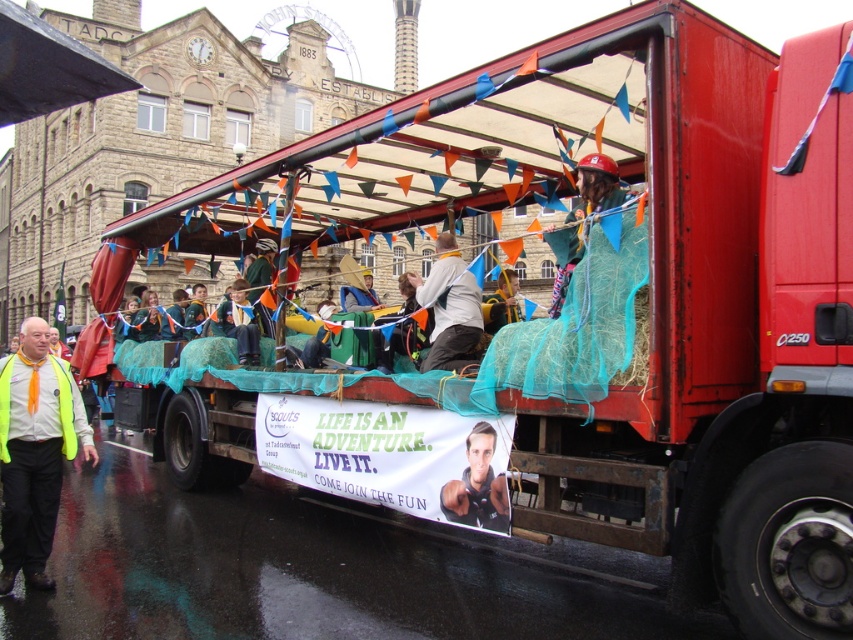
Question: Which object is closer to the camera taking this photo?

Choices:
 (A) white fabric at center
 (B) neon yellow vest at left
 (C) green fabric-covered figure at center

Answer: (B)

Question: Does white fabric at center come in front of matte green netting at center?

Choices:
 (A) yes
 (B) no

Answer: (A)

Question: Can you confirm if white fabric at center is smaller than matte green netting at center?

Choices:
 (A) no
 (B) yes

Answer: (A)

Question: Does smooth skin portrait at center appear under green fabric-covered figure at center?

Choices:
 (A) no
 (B) yes

Answer: (B)

Question: Which point is farther to the camera?

Choices:
 (A) (251, 332)
 (B) (486, 490)

Answer: (A)

Question: Which of the following is the farthest from the observer?

Choices:
 (A) neon yellow vest at left
 (B) netted fabric figure at center
 (C) white fabric at center

Answer: (C)